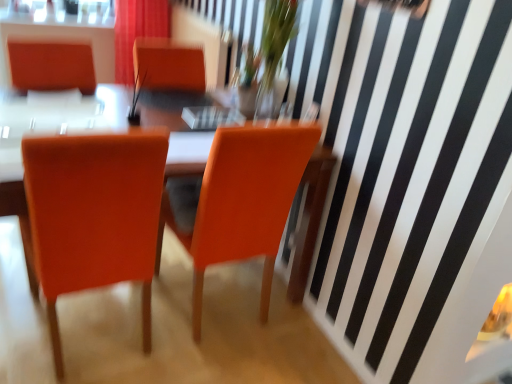
Question: Is matte orange chair at center, placed as the first chair when sorted from left to right, positioned beyond the bounds of translucent glass vase at upper center?

Choices:
 (A) no
 (B) yes

Answer: (B)

Question: Considering the relative sizes of matte orange chair at center, the second chair positioned from the right, and translucent glass vase at upper center in the image provided, is matte orange chair at center, the second chair positioned from the right, thinner than translucent glass vase at upper center?

Choices:
 (A) yes
 (B) no

Answer: (B)

Question: Would you say translucent glass vase at upper center is part of matte orange chair at center, placed as the first chair when sorted from left to right,'s contents?

Choices:
 (A) yes
 (B) no

Answer: (B)

Question: From a real-world perspective, is matte orange chair at center, placed as the first chair when sorted from left to right, located beneath translucent glass vase at upper center?

Choices:
 (A) yes
 (B) no

Answer: (A)

Question: From the image's perspective, would you say matte orange chair at center, the second chair positioned from the right, is shown under translucent glass vase at upper center?

Choices:
 (A) no
 (B) yes

Answer: (B)

Question: From a real-world perspective, does matte orange chair at center, placed as the first chair when sorted from left to right, stand above translucent glass vase at upper center?

Choices:
 (A) yes
 (B) no

Answer: (B)

Question: Is orange leather chair at center, the 2th chair positioned from the left, bigger than matte orange chair at center, placed as the first chair when sorted from left to right?

Choices:
 (A) yes
 (B) no

Answer: (B)

Question: Considering the relative sizes of orange leather chair at center, marked as the 1th chair in a right-to-left arrangement, and matte orange chair at center, placed as the first chair when sorted from left to right, in the image provided, is orange leather chair at center, marked as the 1th chair in a right-to-left arrangement, shorter than matte orange chair at center, placed as the first chair when sorted from left to right,?

Choices:
 (A) no
 (B) yes

Answer: (A)

Question: Is orange leather chair at center, marked as the 1th chair in a right-to-left arrangement, facing away from matte orange chair at center, placed as the first chair when sorted from left to right?

Choices:
 (A) yes
 (B) no

Answer: (B)

Question: From the image's perspective, is orange leather chair at center, the 2th chair positioned from the left, above matte orange chair at center, placed as the first chair when sorted from left to right?

Choices:
 (A) no
 (B) yes

Answer: (B)

Question: Can you see orange leather chair at center, the 2th chair positioned from the left, touching matte orange chair at center, placed as the first chair when sorted from left to right?

Choices:
 (A) no
 (B) yes

Answer: (A)

Question: Can you confirm if orange leather chair at center, marked as the 1th chair in a right-to-left arrangement, is wider than matte orange chair at center, the second chair positioned from the right?

Choices:
 (A) yes
 (B) no

Answer: (A)

Question: Is translucent glass vase at upper center directly adjacent to matte red curtain at upper center?

Choices:
 (A) yes
 (B) no

Answer: (B)